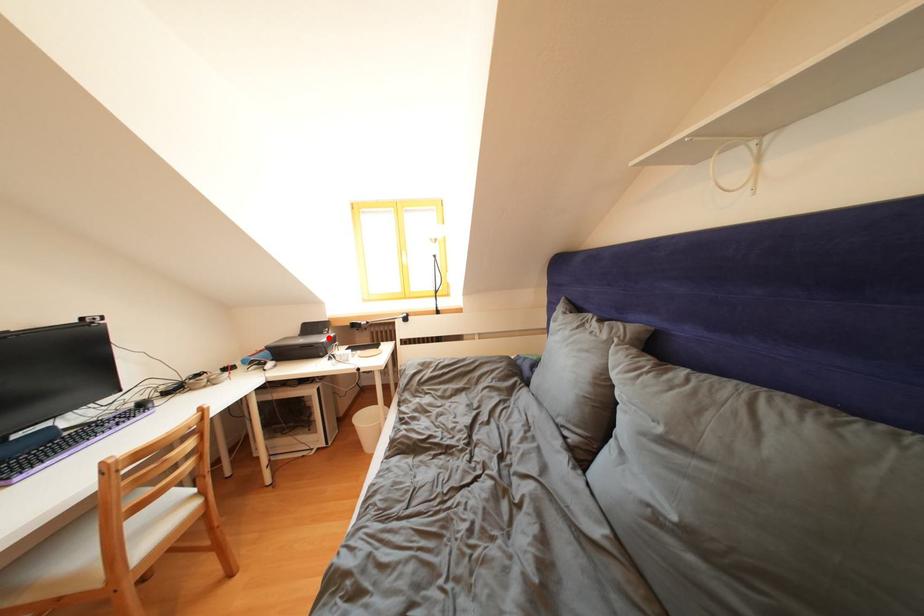
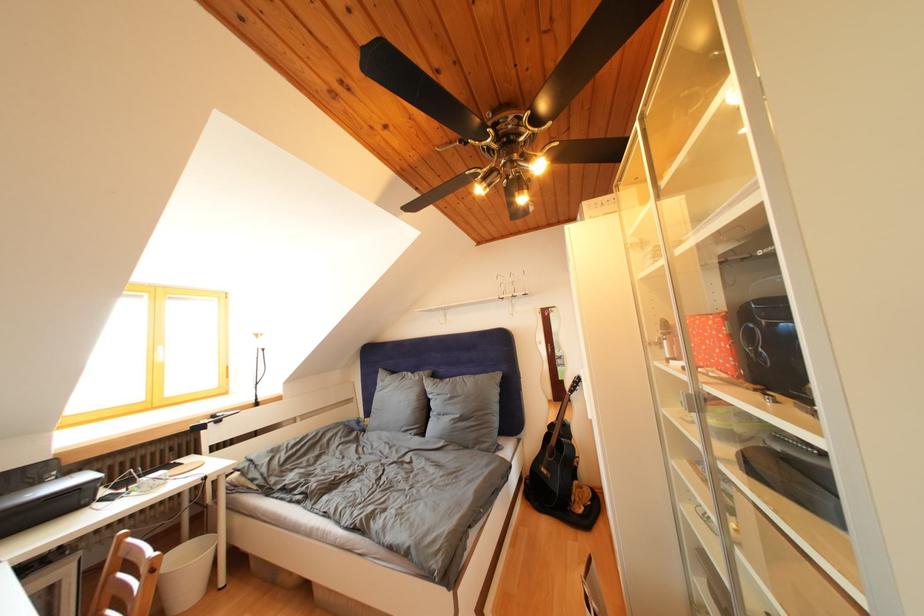
Find the pixel in the second image that matches the highlighted location in the first image.

(44, 488)